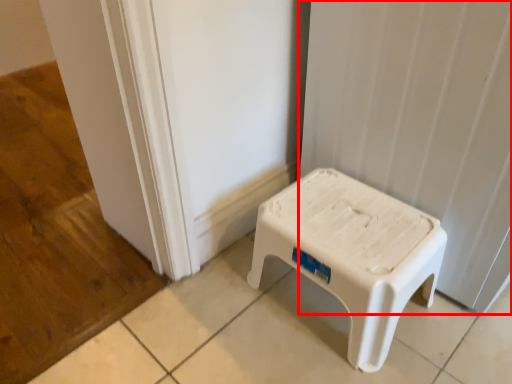
Question: Observing the image, what is the correct spatial positioning of curtain (annotated by the red box) in reference to stool?

Choices:
 (A) right
 (B) left

Answer: (A)